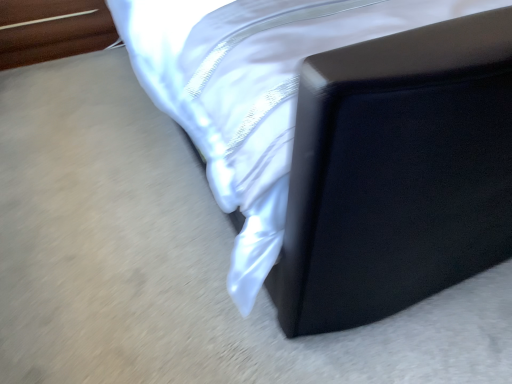
Question: Considering the positions of matte black bed frame at upper right, the first furniture in the right-to-left sequence, and wooden toothpick at upper left, which ranks as the first furniture in left-to-right order, in the image, is matte black bed frame at upper right, the first furniture in the right-to-left sequence, wider or thinner than wooden toothpick at upper left, which ranks as the first furniture in left-to-right order,?

Choices:
 (A) wide
 (B) thin

Answer: (A)

Question: Is matte black bed frame at upper right, acting as the second furniture starting from the left, bigger or smaller than wooden toothpick at upper left, acting as the second furniture starting from the right?

Choices:
 (A) big
 (B) small

Answer: (A)

Question: From a real-world perspective, is matte black bed frame at upper right, the first furniture in the right-to-left sequence, physically located above or below wooden toothpick at upper left, which ranks as the first furniture in left-to-right order?

Choices:
 (A) above
 (B) below

Answer: (A)

Question: Based on their sizes in the image, would you say wooden toothpick at upper left, acting as the second furniture starting from the right, is bigger or smaller than matte black bed frame at upper right, the first furniture in the right-to-left sequence?

Choices:
 (A) big
 (B) small

Answer: (B)

Question: Is point (30, 4) closer or farther from the camera than point (266, 226)?

Choices:
 (A) farther
 (B) closer

Answer: (A)

Question: Would you say wooden toothpick at upper left, which ranks as the first furniture in left-to-right order, is to the left or to the right of matte black bed frame at upper right, the first furniture in the right-to-left sequence, in the picture?

Choices:
 (A) left
 (B) right

Answer: (A)

Question: Which is correct: wooden toothpick at upper left, which ranks as the first furniture in left-to-right order, is inside matte black bed frame at upper right, acting as the second furniture starting from the left, or outside of it?

Choices:
 (A) outside
 (B) inside

Answer: (A)